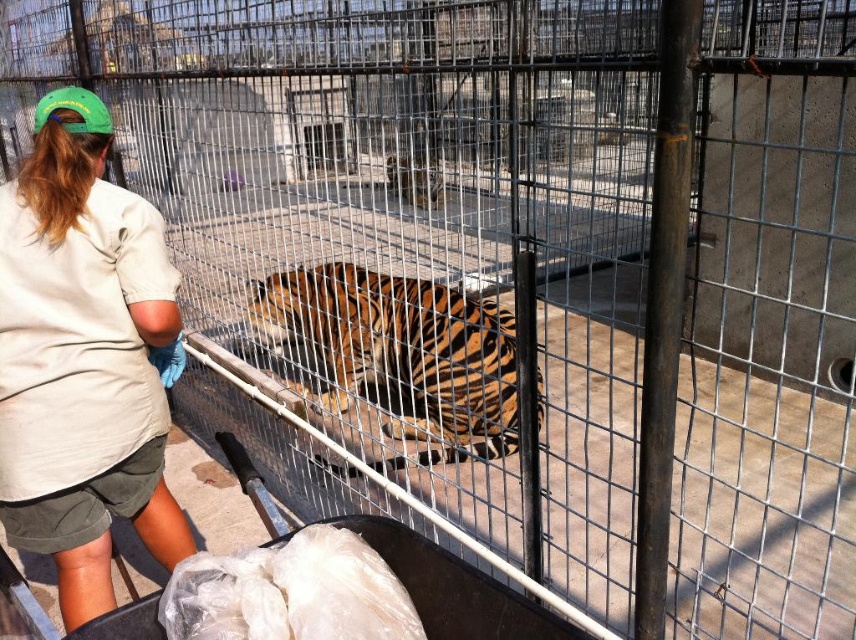
Question: Does beige cotton shirt at center appear over orange-brown striped tiger at center?

Choices:
 (A) no
 (B) yes

Answer: (B)

Question: Where is beige cotton shirt at center located in relation to orange-brown striped tiger at center in the image?

Choices:
 (A) below
 (B) above

Answer: (B)

Question: Does beige cotton shirt at center appear over orange-brown striped tiger at center?

Choices:
 (A) no
 (B) yes

Answer: (B)

Question: Among these points, which one is nearest to the camera?

Choices:
 (A) (456, 312)
 (B) (149, 300)

Answer: (B)

Question: Which point is closer to the camera?

Choices:
 (A) click(x=31, y=372)
 (B) click(x=498, y=435)

Answer: (A)